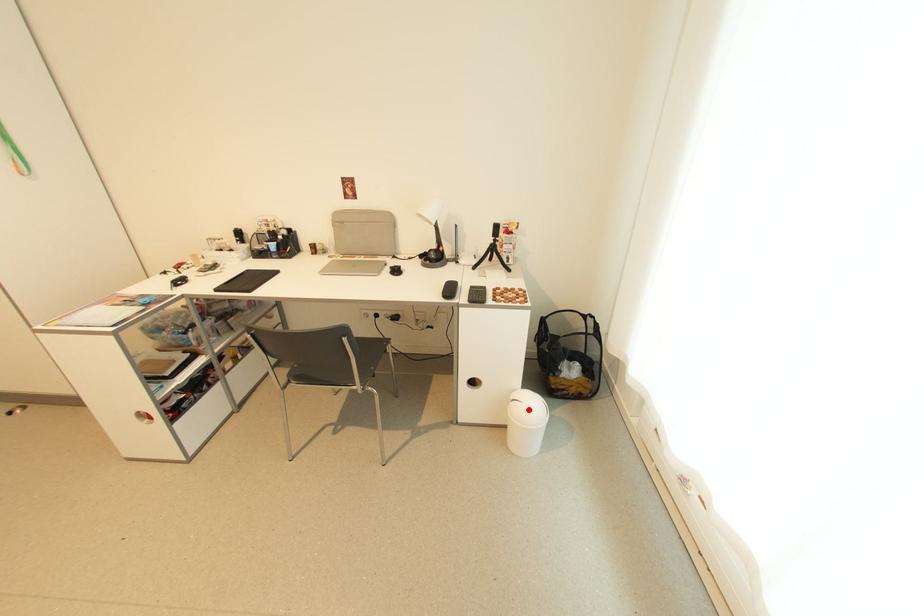
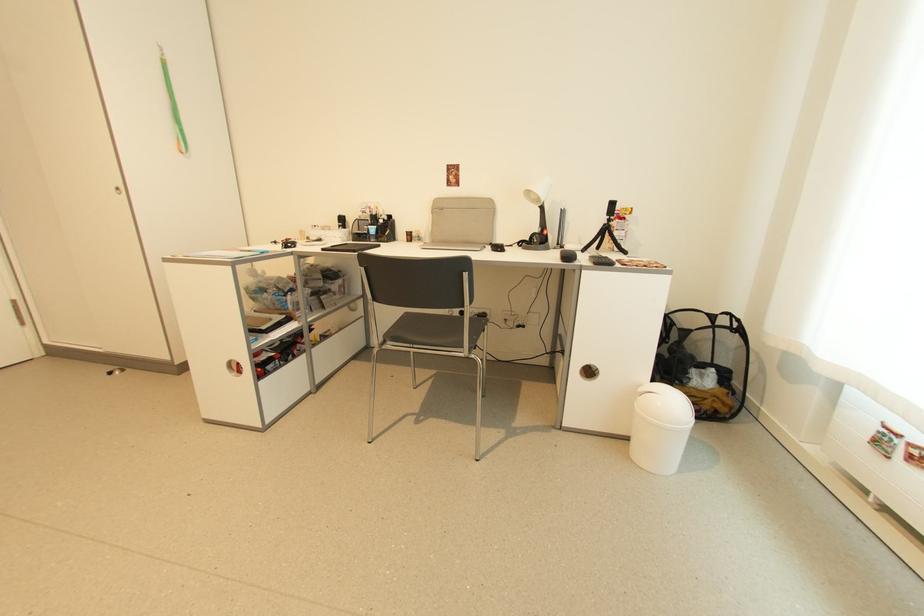
The point at the highlighted location is marked in the first image. Where is the corresponding point in the second image?

(664, 405)